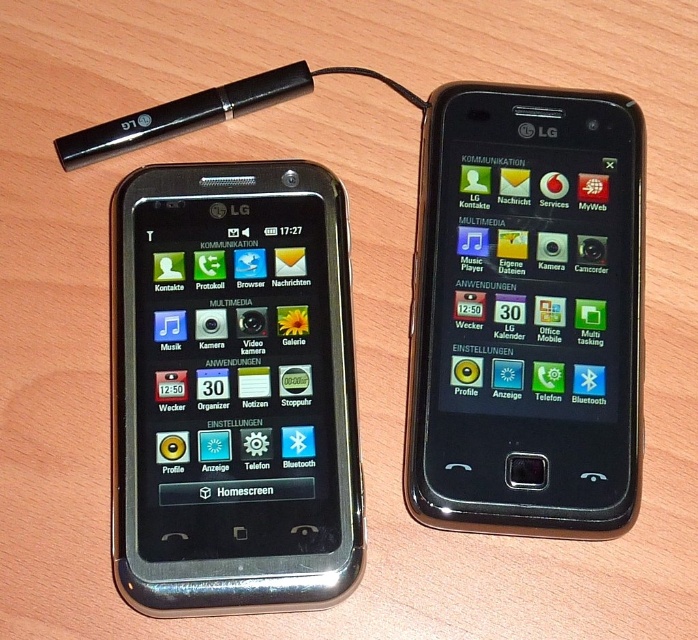
Question: Is black glossy smartphone at left below black glossy smartphone at center?

Choices:
 (A) no
 (B) yes

Answer: (B)

Question: Observing the image, what is the correct spatial positioning of black glossy smartphone at left in reference to black glossy smartphone at center?

Choices:
 (A) below
 (B) above

Answer: (A)

Question: Which object appears farthest from the camera in this image?

Choices:
 (A) black glossy smartphone at center
 (B) black glossy smartphone at left

Answer: (A)

Question: Which of the following is the farthest from the observer?

Choices:
 (A) black glossy smartphone at center
 (B) black glossy smartphone at left

Answer: (A)

Question: Can you confirm if black glossy smartphone at left is smaller than black glossy smartphone at center?

Choices:
 (A) no
 (B) yes

Answer: (A)